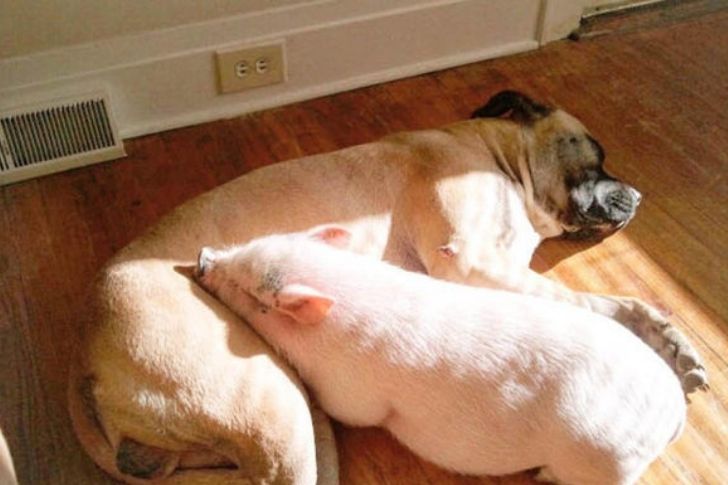
This screenshot has height=485, width=728. What are the coordinates of `baseboard` in the screenshot? It's located at (362, 57).